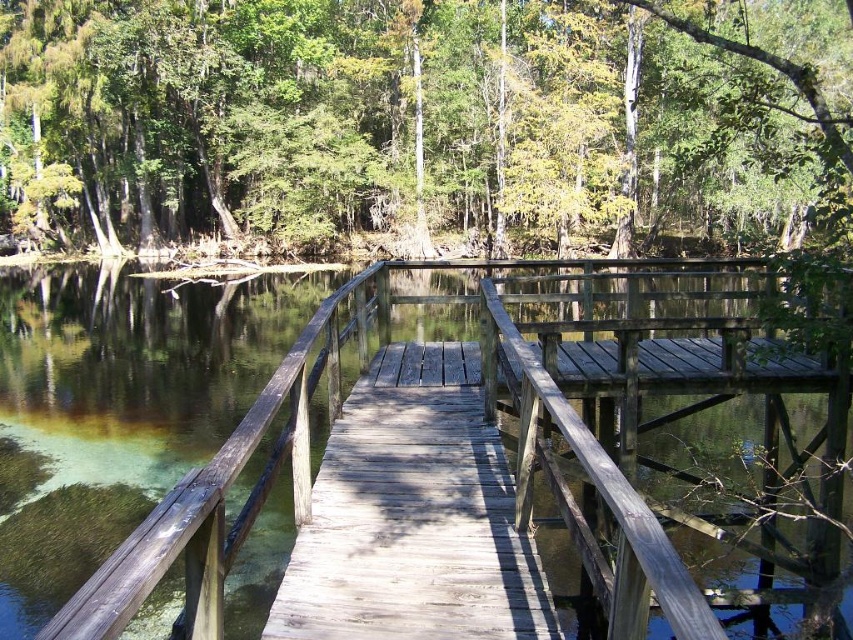
What are the coordinates of the green matte tree at upper center in the image?

The green matte tree at upper center is located at coordinates point (425,122).

You are standing on the wooden boardwalk and looking towards the water. There are two points marked on the boardwalk, point (x=68, y=132) and point (x=635, y=348). Which point is closer to you?

Point (x=68, y=132) is further to the camera than point (x=635, y=348), so the closer point to you is point (x=635, y=348).

You are a painter setting up your easel to capture the scene of the green matte tree at upper center and the weathered wood bridge at center. You want to ensure your canvas can accommodate both subjects. Based on their widths, which object should you consider the width of when choosing your canvas size?

The green matte tree at upper center might be wider than the weathered wood bridge at center, so you should consider the width of the green matte tree at upper center when choosing your canvas size to ensure it fits both subjects.